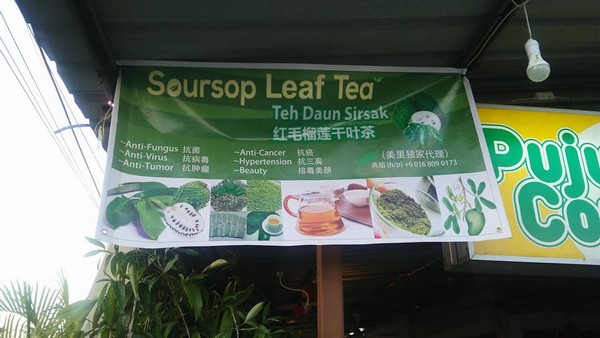
Where is `support beam`? support beam is located at coordinates (332, 260).